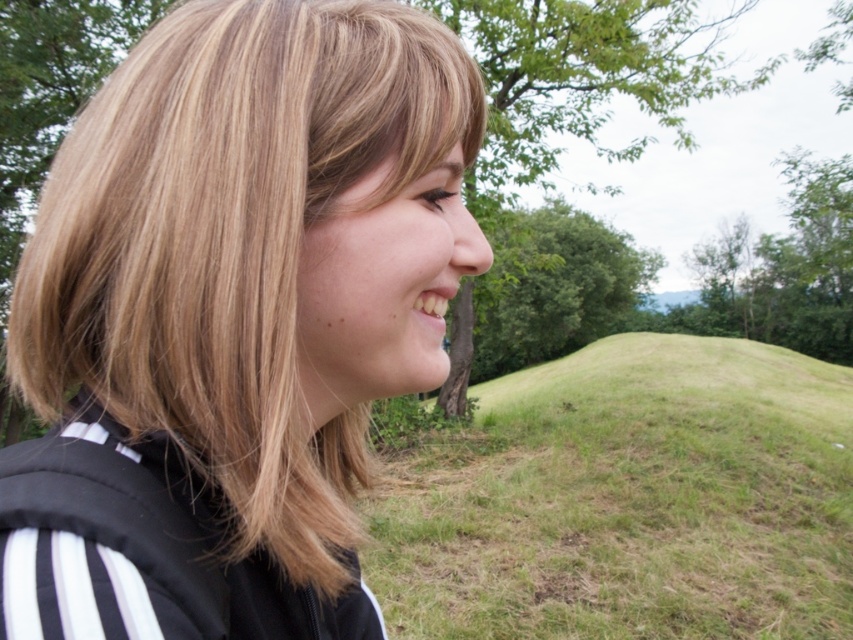
Is blonde hair at center to the left of green grassy hill at center from the viewer's perspective?

Yes, blonde hair at center is to the left of green grassy hill at center.

Which is in front, point (241, 262) or point (741, 480)?

Point (241, 262) is in front.

Which is behind, point (184, 220) or point (490, 460)?

The point (490, 460) is behind.

This screenshot has height=640, width=853. What are the coordinates of `blonde hair at center` in the screenshot? It's located at (231, 317).